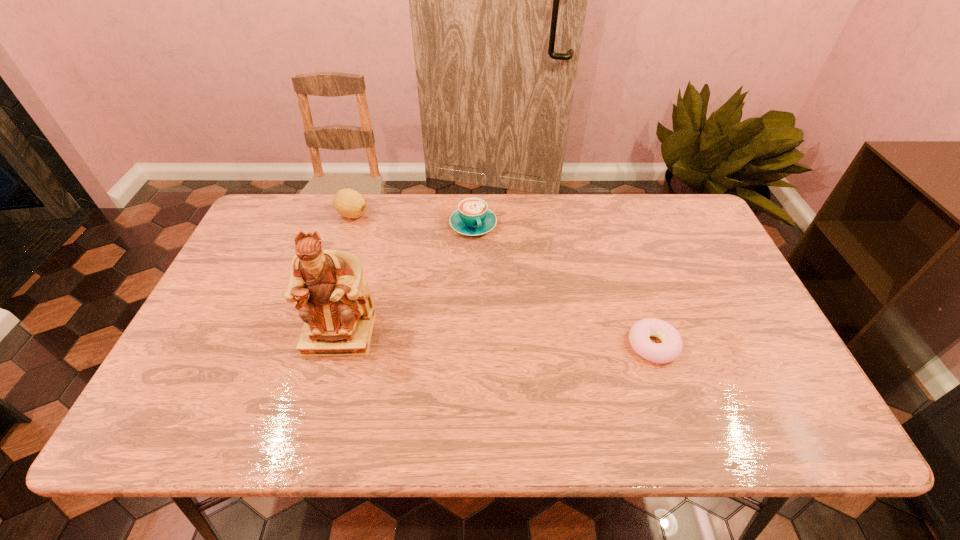
Where is `the tallest object`? This screenshot has width=960, height=540. the tallest object is located at coordinates (334, 301).

Identify the location of the rightmost object. The height and width of the screenshot is (540, 960). (671, 347).

Where is `the shortest object`? The image size is (960, 540). the shortest object is located at coordinates (671, 347).

At what (x,y) coordinates should I click in order to perform the action: click on cappuccino. Please return your answer as a coordinate pair (x, y). This screenshot has width=960, height=540. Looking at the image, I should click on (472, 217).

The width and height of the screenshot is (960, 540). Identify the location of the third object from left to right. (472, 217).

At what (x,y) coordinates should I click in order to perform the action: click on the third shortest object. Please return your answer as a coordinate pair (x, y). The height and width of the screenshot is (540, 960). Looking at the image, I should click on (349, 203).

At what (x,y) coordinates should I click in order to perform the action: click on free space located 0.080m on the front-facing side of the figurine. Please return your answer as a coordinate pair (x, y). Looking at the image, I should click on (325, 387).

Locate an element on the screen. This screenshot has height=540, width=960. vacant space situated on the left of the rightmost object is located at coordinates (486, 345).

Find the location of `free spot located 0.300m with the handle on the right side of the second object from right to left`. free spot located 0.300m with the handle on the right side of the second object from right to left is located at coordinates (514, 311).

Where is `vacant position located with the handle on the right side of the second object from right to left`? Image resolution: width=960 pixels, height=540 pixels. vacant position located with the handle on the right side of the second object from right to left is located at coordinates (492, 266).